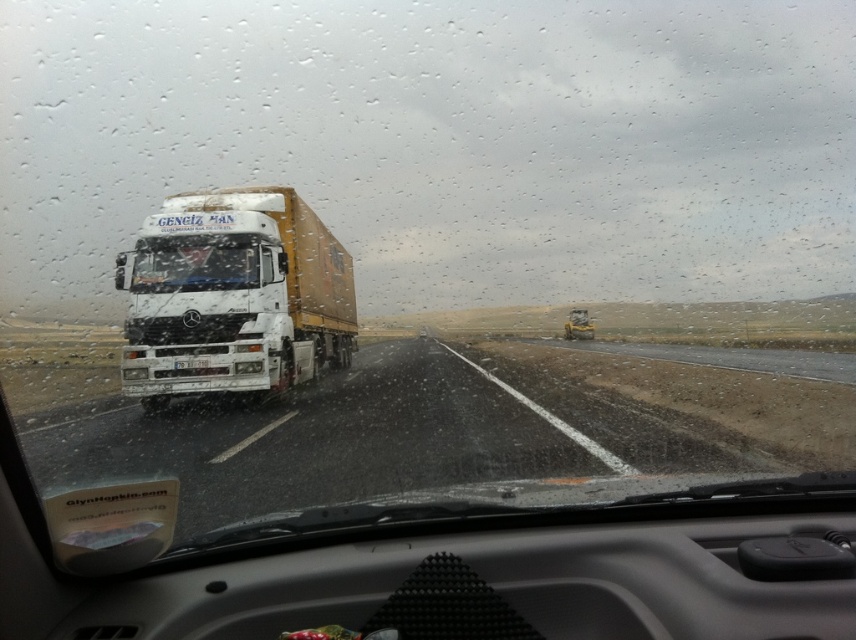
Question: Can you confirm if white matte trailer truck at center is wider than transparent glass windshield at center?

Choices:
 (A) yes
 (B) no

Answer: (A)

Question: Which point is closer to the camera taking this photo?

Choices:
 (A) (140, 278)
 (B) (334, 256)

Answer: (A)

Question: From the image, what is the correct spatial relationship of white matte trailer truck at center in relation to transparent glass windshield at center?

Choices:
 (A) right
 (B) left

Answer: (A)

Question: Which of the following is the closest to the observer?

Choices:
 (A) (176, 275)
 (B) (318, 342)

Answer: (A)

Question: Is white matte trailer truck at center bigger than transparent glass windshield at center?

Choices:
 (A) yes
 (B) no

Answer: (A)